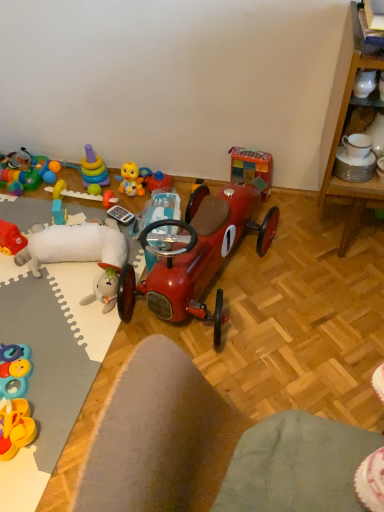
What are the coordinates of `vacant space to the right of translucent plastic block at upper left, the 3th toy positioned from the left` in the screenshot? It's located at (84, 215).